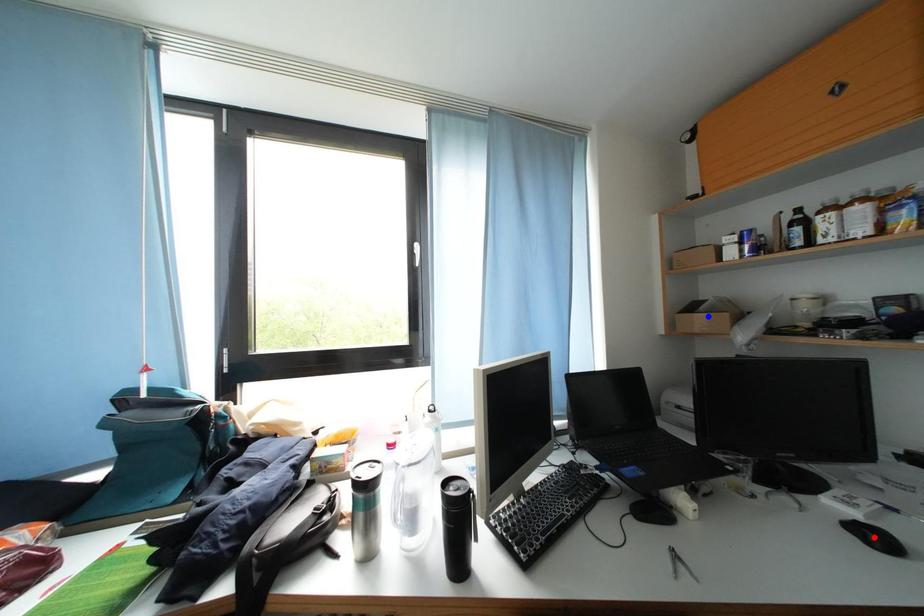
Question: In the image, two points are highlighted. Which point is nearer to the camera? Reply with the corresponding letter.

Choices:
 (A) blue point
 (B) red point

Answer: (B)